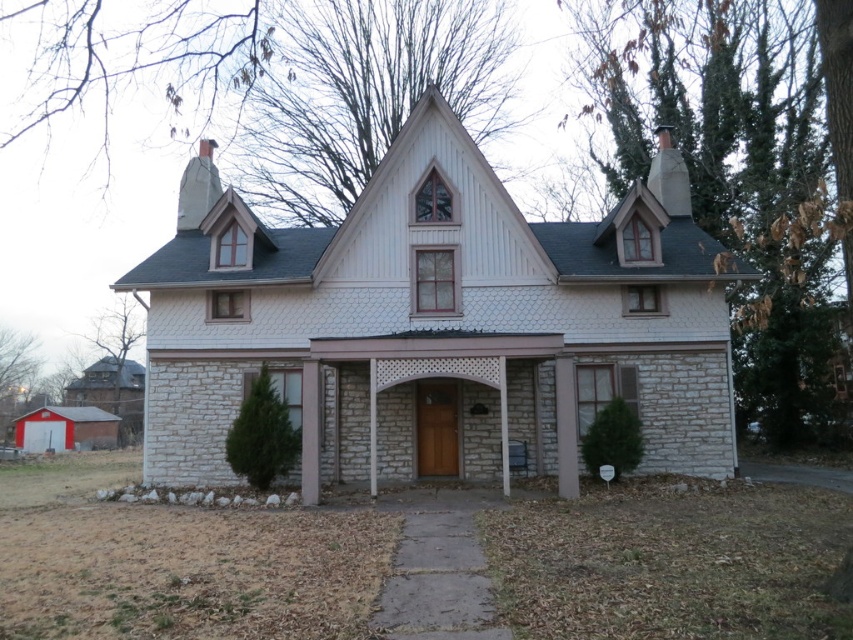
Who is taller, white stone pillar at right or white stone pillar at center?

With more height is white stone pillar at center.

In order to click on white stone pillar at right in this screenshot , I will do click(x=566, y=428).

What are the coordinates of `white stone pillar at right` in the screenshot? It's located at (566, 428).